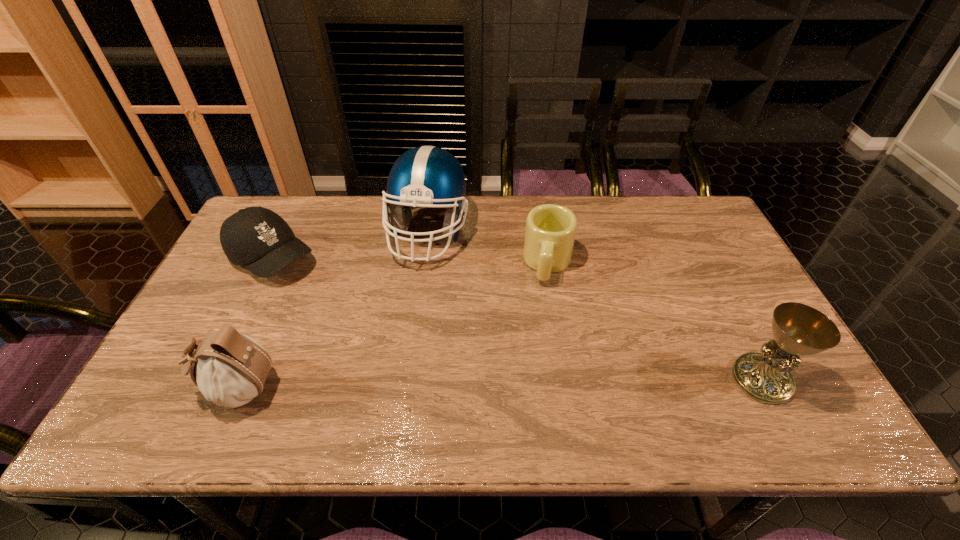
The width and height of the screenshot is (960, 540). What are the coordinates of `vacant space positioned with the handle on the side of the fourth object from left to right` in the screenshot? It's located at (535, 361).

The image size is (960, 540). Identify the location of vacant space located on the front-facing side of the baseball cap. (333, 298).

I want to click on vacant area situated on the front-facing side of the baseball cap, so click(x=322, y=290).

At what (x,y) coordinates should I click in order to perform the action: click on free space located on the front-facing side of the baseball cap. Please return your answer as a coordinate pair (x, y). Looking at the image, I should click on (365, 320).

This screenshot has height=540, width=960. Identify the location of free region located at the front of the football helmet with the faceguard. (502, 336).

Locate an element on the screen. This screenshot has width=960, height=540. free space located at the front of the football helmet with the faceguard is located at coordinates (464, 287).

Locate an element on the screen. The width and height of the screenshot is (960, 540). vacant space located at the front of the football helmet with the faceguard is located at coordinates (455, 276).

Locate an element on the screen. This screenshot has height=540, width=960. baseball cap that is at the far edge is located at coordinates (255, 237).

Find the location of `football helmet that is at the far edge`. football helmet that is at the far edge is located at coordinates (427, 176).

Locate an element on the screen. pouch present at the near edge is located at coordinates (230, 369).